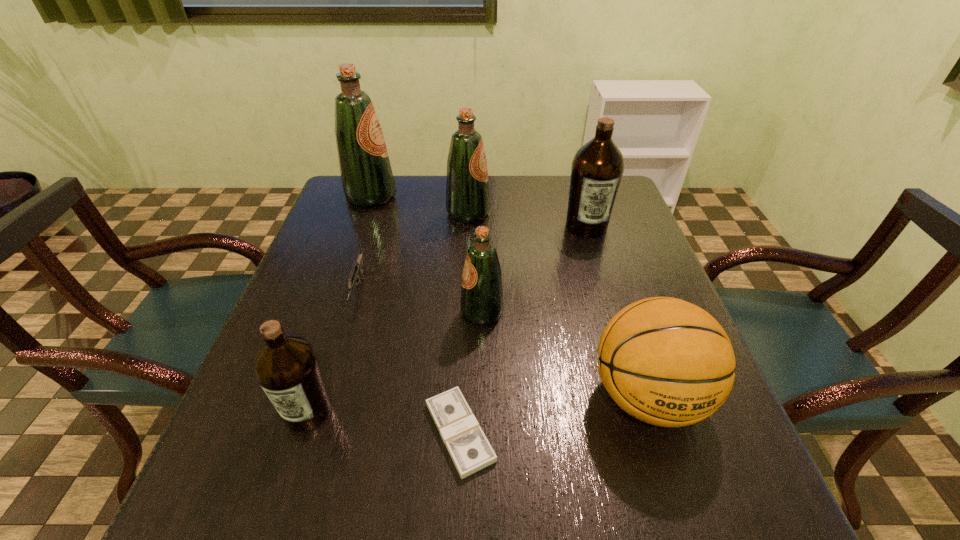
Find the location of a particular element. The image size is (960, 540). grey gun is located at coordinates (357, 267).

Find the location of a particular element. gun is located at coordinates (357, 267).

The height and width of the screenshot is (540, 960). What are the coordinates of `the shortest object` in the screenshot? It's located at (470, 450).

At what (x,y) coordinates should I click in order to perform the action: click on vacant space situated on the front-facing side of the biggest green olive oil. Please return your answer as a coordinate pair (x, y). This screenshot has height=540, width=960. Looking at the image, I should click on (420, 197).

Find the location of a particular element. The image size is (960, 540). vacant space situated on the front-facing side of the second biggest green olive oil is located at coordinates (560, 214).

Where is `free region located 0.360m on the label of the rightmost olive oil`? This screenshot has width=960, height=540. free region located 0.360m on the label of the rightmost olive oil is located at coordinates (623, 347).

Where is `vacant space located on the front-facing side of the fourth farthest olive oil`? The image size is (960, 540). vacant space located on the front-facing side of the fourth farthest olive oil is located at coordinates (429, 313).

This screenshot has width=960, height=540. Identify the location of vacant region located 0.090m on the front-facing side of the fourth farthest olive oil. (420, 313).

Identify the location of vacant area situated on the front-facing side of the fourth farthest olive oil. This screenshot has height=540, width=960. (284, 313).

At what (x,y) coordinates should I click in order to perform the action: click on vacant area located on the surface of the orange basketball near the brand logo. Please return your answer as a coordinate pair (x, y). Looking at the image, I should click on (686, 516).